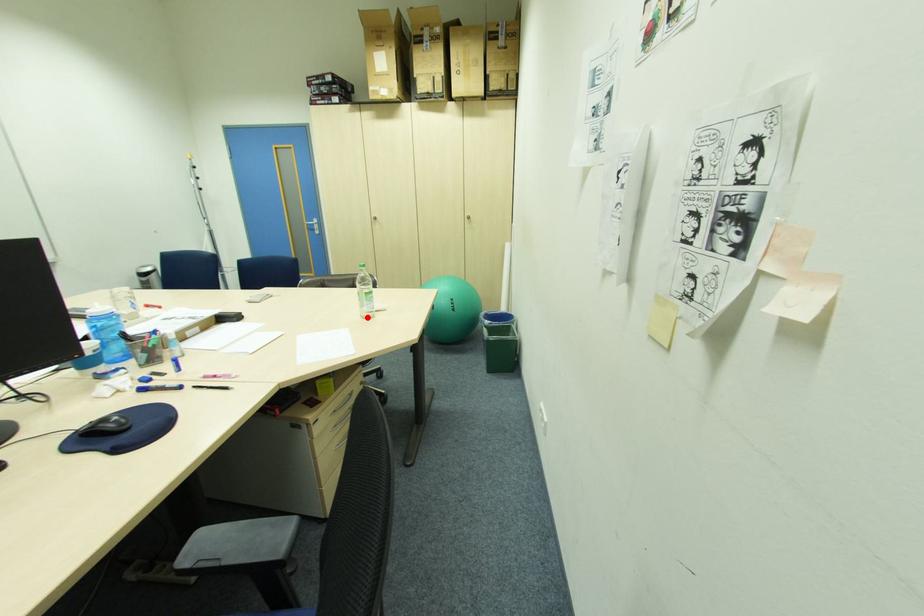
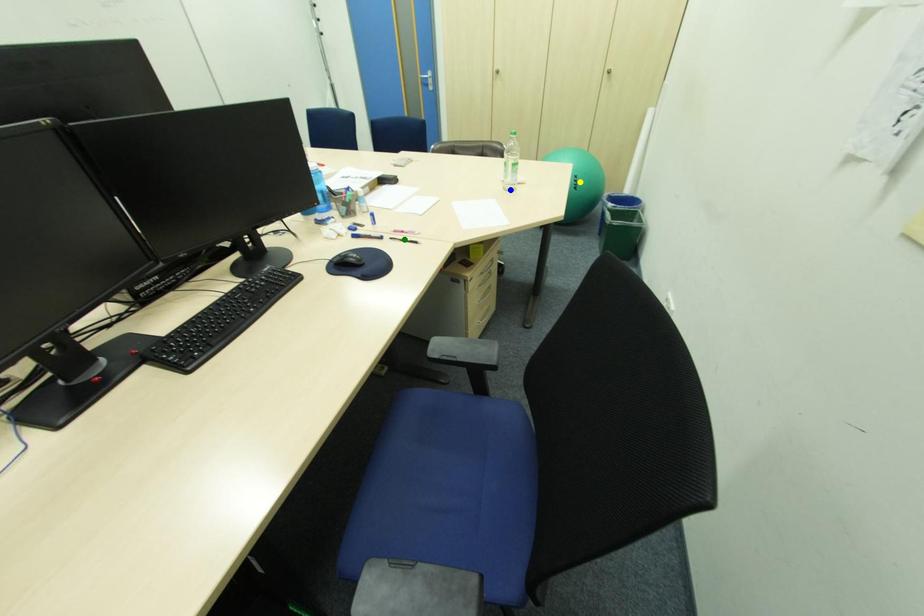
Question: I am providing you with two images of the same scene from different viewpoints. A red point is marked on the first image. You are given multiple points on the second image. Which spot in image 2 lines up with the point in image 1?

Choices:
 (A) yellow point
 (B) blue point
 (C) green point

Answer: (B)